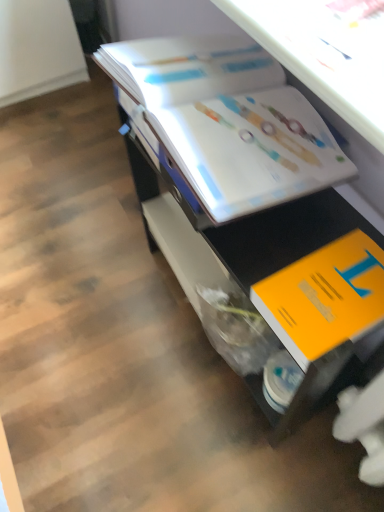
Question: Considering the positions of orange matte book at lower right, positioned as the first book in bottom-to-top order, and white glossy book at upper center in the image, is orange matte book at lower right, positioned as the first book in bottom-to-top order, wider or thinner than white glossy book at upper center?

Choices:
 (A) wide
 (B) thin

Answer: (B)

Question: Considering the positions of point click(x=307, y=305) and point click(x=292, y=411), is point click(x=307, y=305) closer or farther from the camera than point click(x=292, y=411)?

Choices:
 (A) closer
 (B) farther

Answer: (A)

Question: Which is nearer to the white glossy book at upper center, the second book ordered from the bottom?

Choices:
 (A) white glossy book at upper center
 (B) orange matte book at lower right, positioned as the first book in bottom-to-top order

Answer: (A)

Question: Which is farther from the white glossy book at upper center?

Choices:
 (A) orange matte book at lower right, positioned as the first book in bottom-to-top order
 (B) white glossy book at upper center, which ranks as the first book in top-to-bottom order

Answer: (A)